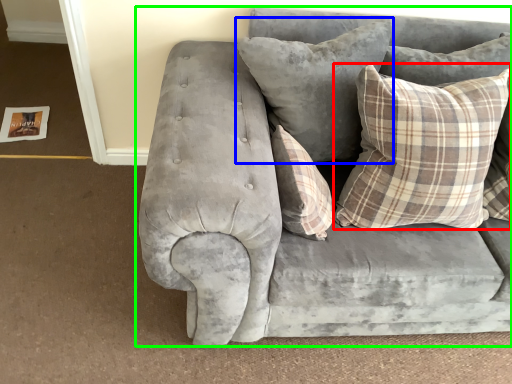
Question: Which object is the closest to the pillow (highlighted by a red box)? Choose among these: pillow (highlighted by a blue box) or studio couch (highlighted by a green box).

Choices:
 (A) pillow
 (B) studio couch

Answer: (A)